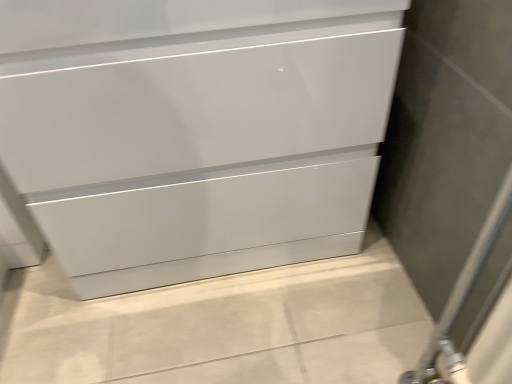
Question: Is glossy white chest of drawers at center wider or thinner than matte gray screen door at right?

Choices:
 (A) thin
 (B) wide

Answer: (B)

Question: Considering the relative positions of glossy white chest of drawers at center and matte gray screen door at right in the image provided, is glossy white chest of drawers at center to the left or to the right of matte gray screen door at right?

Choices:
 (A) left
 (B) right

Answer: (A)

Question: In terms of height, does glossy white chest of drawers at center look taller or shorter compared to matte gray screen door at right?

Choices:
 (A) short
 (B) tall

Answer: (A)

Question: Would you say matte gray screen door at right is to the left or to the right of glossy white chest of drawers at center in the picture?

Choices:
 (A) right
 (B) left

Answer: (A)

Question: Relative to glossy white chest of drawers at center, is matte gray screen door at right in front or behind?

Choices:
 (A) front
 (B) behind

Answer: (A)

Question: In terms of width, does matte gray screen door at right look wider or thinner when compared to glossy white chest of drawers at center?

Choices:
 (A) wide
 (B) thin

Answer: (B)

Question: Is matte gray screen door at right situated inside glossy white chest of drawers at center or outside?

Choices:
 (A) outside
 (B) inside

Answer: (A)